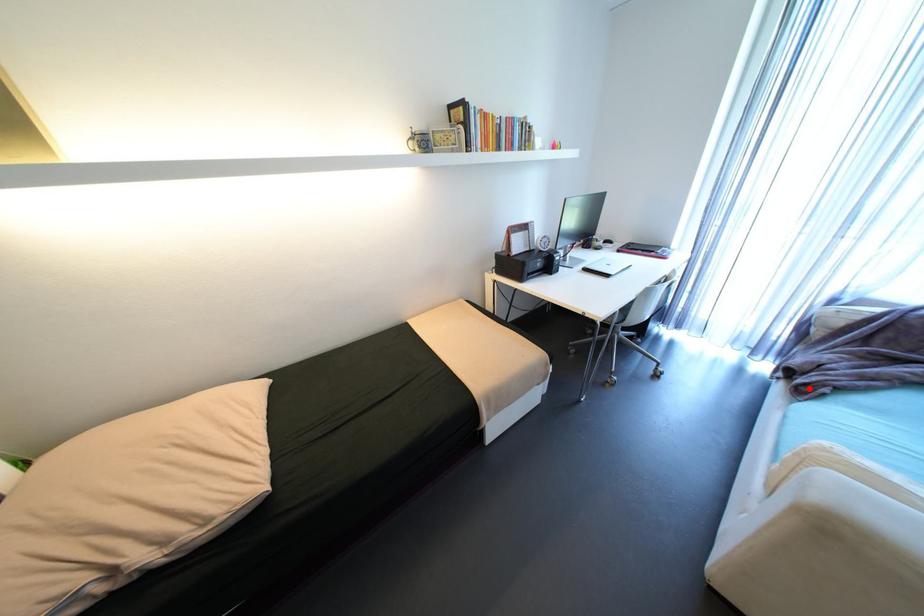
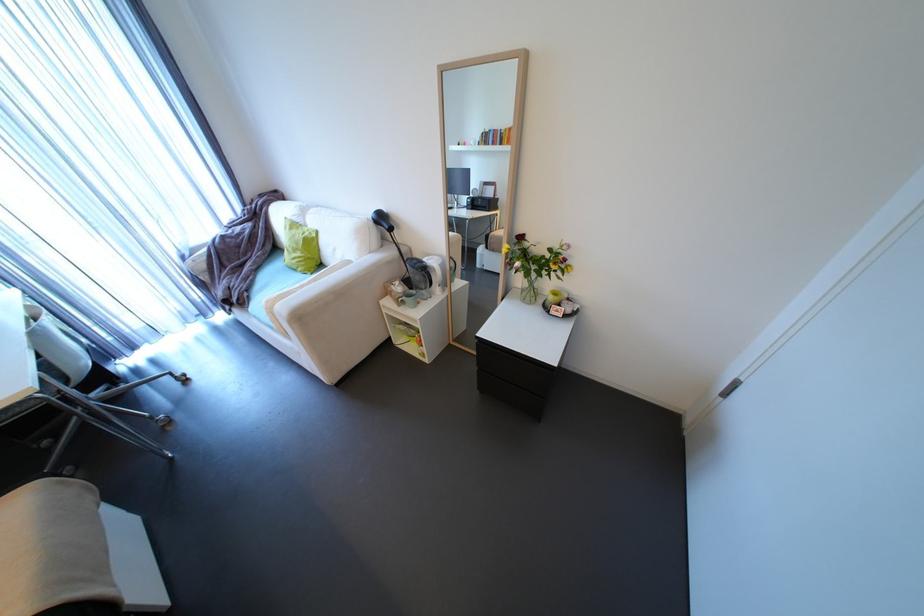
Question: I am providing you with two images of the same scene from different viewpoints. Image1 has a red point marked. In image2, the corresponding 3D location appears at what relative position? Reply with the corresponding letter.

Choices:
 (A) Closer
 (B) Farther

Answer: (B)